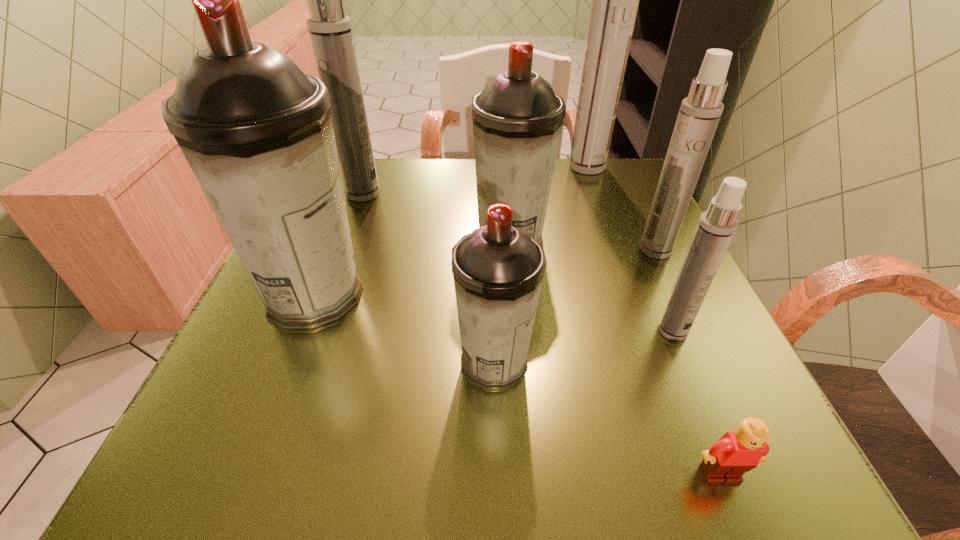
At what (x,y) coordinates should I click in order to perform the action: click on free space between the second smallest gray aerosol can and the smallest white aerosol can. Please return your answer as a coordinate pair (x, y). The image size is (960, 540). Looking at the image, I should click on (591, 285).

In order to click on vacant space in between the smallest gray aerosol can and the smallest white aerosol can in this screenshot , I will do `click(584, 347)`.

Where is `free space between the second biggest gray aerosol can and the smallest white aerosol can`? The height and width of the screenshot is (540, 960). free space between the second biggest gray aerosol can and the smallest white aerosol can is located at coordinates (591, 285).

Where is `vacant area that lies between the leftmost gray aerosol can and the shortest object`? This screenshot has width=960, height=540. vacant area that lies between the leftmost gray aerosol can and the shortest object is located at coordinates (517, 385).

The image size is (960, 540). I want to click on free spot between the leftmost gray aerosol can and the Lego, so click(517, 385).

The image size is (960, 540). Identify the location of vacant region between the second biggest white aerosol can and the second smallest gray aerosol can. tap(437, 217).

Locate an element on the screen. This screenshot has width=960, height=540. free space between the leftmost gray aerosol can and the tallest aerosol can is located at coordinates (451, 231).

You are a GUI agent. You are given a task and a screenshot of the screen. Output one action in this format:
    pyautogui.click(x=<x>, y=<y>)
    Task: Click on the empty space between the brown Lego and the smallest white aerosol can
    
    Given the screenshot: What is the action you would take?
    pyautogui.click(x=697, y=403)

Point out which object is positioned as the fourth nearest to the smallest gray aerosol can. Please provide its 2D coordinates. Your answer should be formatted as a tuple, i.e. [(x, y)], where the tuple contains the x and y coordinates of a point satisfying the conditions above.

[(716, 227)]

At what (x,y) coordinates should I click in order to perform the action: click on the closest object to the smallest gray aerosol can. Please return your answer as a coordinate pair (x, y). Looking at the image, I should click on (257, 132).